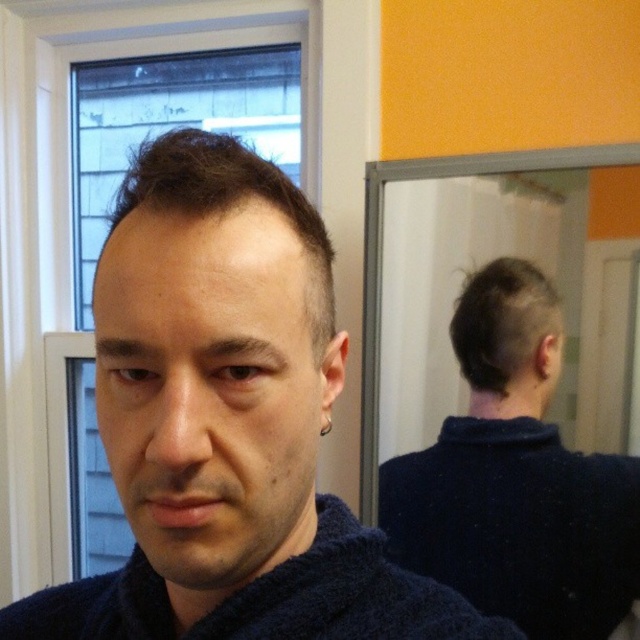
Based on the scene description, which object is shorter between the dark blue knitted bathrobe at center and the dark brown textured hair at upper center?

The dark blue knitted bathrobe at center is shorter than the dark brown textured hair at upper center according to the description.

You are a fashion designer observing a person in a dark blue sweater at back and dark brown textured hair at upper center. Which item is taller?

The dark blue sweater at back has a greater height compared to the dark brown textured hair at upper center.

You are a photographer trying to capture a candid shot of the person in the scene. You notice the dark blue sweater at back and the dark matte hair at back in your viewfinder. To ensure both objects are in focus, what is the minimum distance you should set your camera lens to?

The dark blue sweater at back is 5.14 inches away from the dark matte hair at back. To ensure both are in focus, the minimum focus distance should be set to accommodate the furthest object, which is the dark blue sweater at back, since it is farther away than the dark matte hair at back.